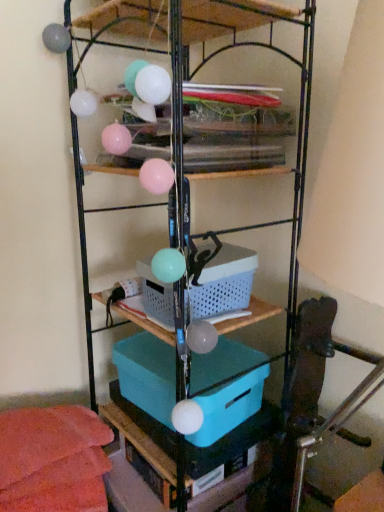
Identify the location of plastic/mesh basket at center. The width and height of the screenshot is (384, 512). (224, 283).

Describe the element at coordinates (147, 374) in the screenshot. The height and width of the screenshot is (512, 384). I see `teal plastic box at center` at that location.

Identify the location of blue plastic basket at center. The image size is (384, 512). (188, 71).

Considering the sizes of objects blue plastic basket at center and plastic/mesh basket at center in the image provided, who is wider, blue plastic basket at center or plastic/mesh basket at center?

blue plastic basket at center is wider.

Is blue plastic basket at center bigger than plastic/mesh basket at center?

Correct, blue plastic basket at center is larger in size than plastic/mesh basket at center.

The image size is (384, 512). In order to click on basket above the blue plastic basket at center (from a real-world perspective) in this screenshot , I will do `click(224, 283)`.

Which object is more forward, blue plastic basket at center or plastic/mesh basket at center?

Positioned in front is blue plastic basket at center.

From the image's perspective, does plastic/mesh basket at center appear lower than teal plastic box at center?

No.

Is point (231, 268) closer or farther from the camera than point (251, 404)?

Point (231, 268) appears to be closer to the viewer than point (251, 404).

Are plastic/mesh basket at center and teal plastic box at center beside each other?

plastic/mesh basket at center is not next to teal plastic box at center, and they're not touching.

Who is shorter, plastic/mesh basket at center or teal plastic box at center?

plastic/mesh basket at center is shorter.

Does teal plastic box at center have a lesser height compared to plastic/mesh basket at center?

Incorrect, the height of teal plastic box at center does not fall short of that of plastic/mesh basket at center.

Based on the photo, which is more to the left, teal plastic box at center or plastic/mesh basket at center?

Positioned to the left is teal plastic box at center.

From the image's perspective, who appears lower, teal plastic box at center or plastic/mesh basket at center?

teal plastic box at center, from the image's perspective.

Does teal plastic box at center touch plastic/mesh basket at center?

No, teal plastic box at center is not touching plastic/mesh basket at center.

Considering the relative sizes of plastic/mesh basket at center and blue plastic basket at center in the image provided, is plastic/mesh basket at center bigger than blue plastic basket at center?

No.

Which is more to the left, plastic/mesh basket at center or blue plastic basket at center?

From the viewer's perspective, blue plastic basket at center appears more on the left side.

Would you say plastic/mesh basket at center contains blue plastic basket at center?

No, blue plastic basket at center is not surrounded by plastic/mesh basket at center.

This screenshot has height=512, width=384. Find the location of `basket above the blue plastic basket at center (from the image's perspective)`. basket above the blue plastic basket at center (from the image's perspective) is located at coordinates (224, 283).

Does blue plastic basket at center have a larger size compared to teal plastic box at center?

Correct, blue plastic basket at center is larger in size than teal plastic box at center.

Is teal plastic box at center completely or partially inside blue plastic basket at center?

That's correct, teal plastic box at center is inside blue plastic basket at center.

From a real-world perspective, who is located higher, blue plastic basket at center or teal plastic box at center?

blue plastic basket at center is physically above.

Is blue plastic basket at center looking in the opposite direction of teal plastic box at center?

Yes, blue plastic basket at center's orientation is away from teal plastic box at center.

Is teal plastic box at center taller than blue plastic basket at center?

In fact, teal plastic box at center may be shorter than blue plastic basket at center.

Is teal plastic box at center turned away from blue plastic basket at center?

Yes, teal plastic box at center is positioned with its back facing blue plastic basket at center.

Which object is positioned more to the left, teal plastic box at center or blue plastic basket at center?

teal plastic box at center.

You are a GUI agent. You are given a task and a screenshot of the screen. Output one action in this format:
    pyautogui.click(x=<x>, y=<y>)
    Task: Click on the shelf lying on the left of plastic/mesh basket at center
    Image resolution: width=384 pixels, height=512 pixels.
    Given the screenshot: What is the action you would take?
    pyautogui.click(x=188, y=71)

Identify the location of basket above the teal plastic box at center (from the image's perspective). This screenshot has height=512, width=384. (224, 283).

Based on the photo, estimate the real-world distances between objects in this image. Which object is further from teal plastic box at center, plastic/mesh basket at center or blue plastic basket at center?

blue plastic basket at center lies further to teal plastic box at center than the other object.

From the image, which object appears to be farther from blue plastic basket at center, plastic/mesh basket at center or teal plastic box at center?

teal plastic box at center.

Which object lies further to the anchor point blue plastic basket at center, teal plastic box at center or plastic/mesh basket at center?

teal plastic box at center lies further to blue plastic basket at center than the other object.

Based on their spatial positions, is blue plastic basket at center or teal plastic box at center further from plastic/mesh basket at center?

Among the two, teal plastic box at center is located further to plastic/mesh basket at center.

Estimate the real-world distances between objects in this image. Which object is further from teal plastic box at center, blue plastic basket at center or plastic/mesh basket at center?

blue plastic basket at center lies further to teal plastic box at center than the other object.

Based on their spatial positions, is teal plastic box at center or blue plastic basket at center further from plastic/mesh basket at center?

teal plastic box at center is positioned further to the anchor plastic/mesh basket at center.

At what (x,y) coordinates should I click in order to perform the action: click on basket positioned between blue plastic basket at center and teal plastic box at center from near to far. Please return your answer as a coordinate pair (x, y). The height and width of the screenshot is (512, 384). Looking at the image, I should click on (224, 283).